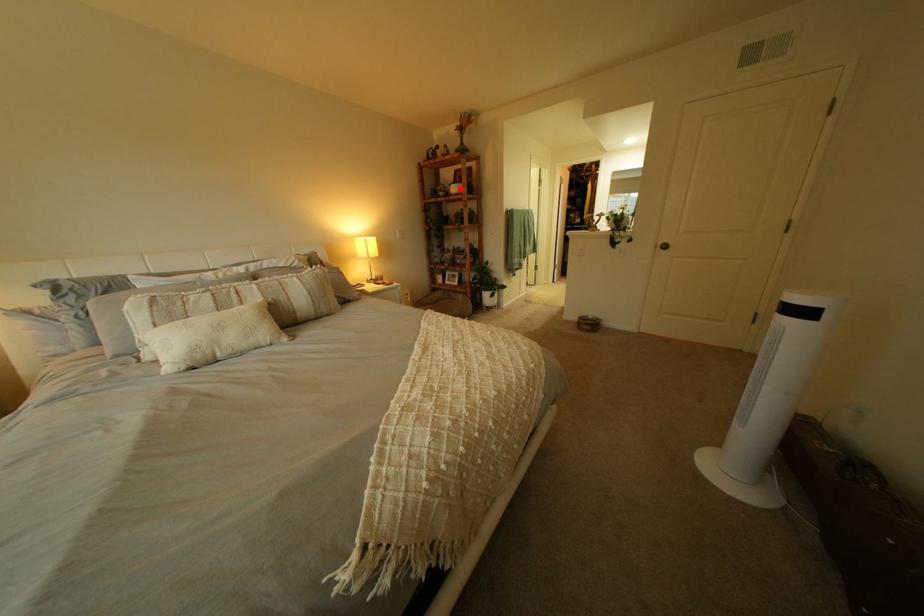
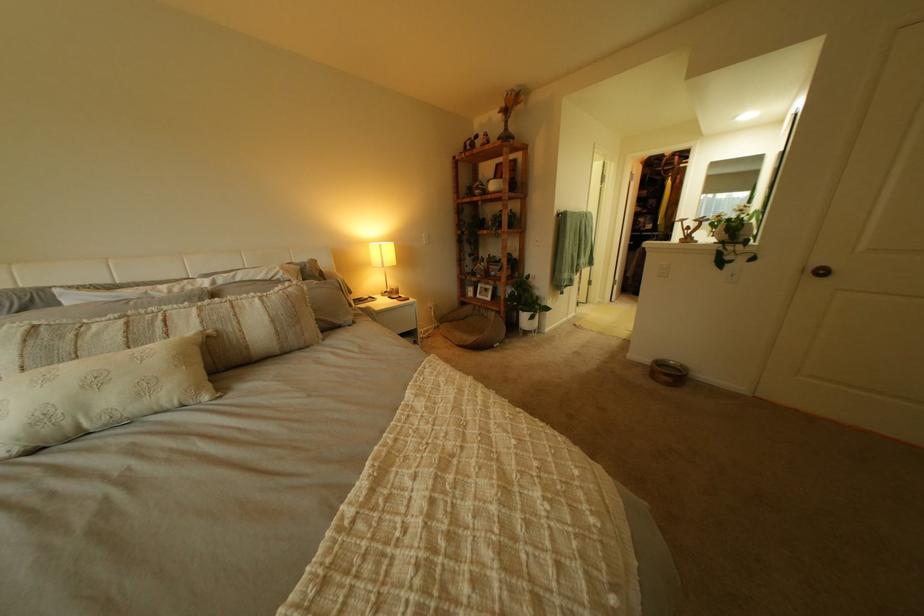
Where in the second image is the point corresponding to the highlighted location from the first image?

(497, 185)